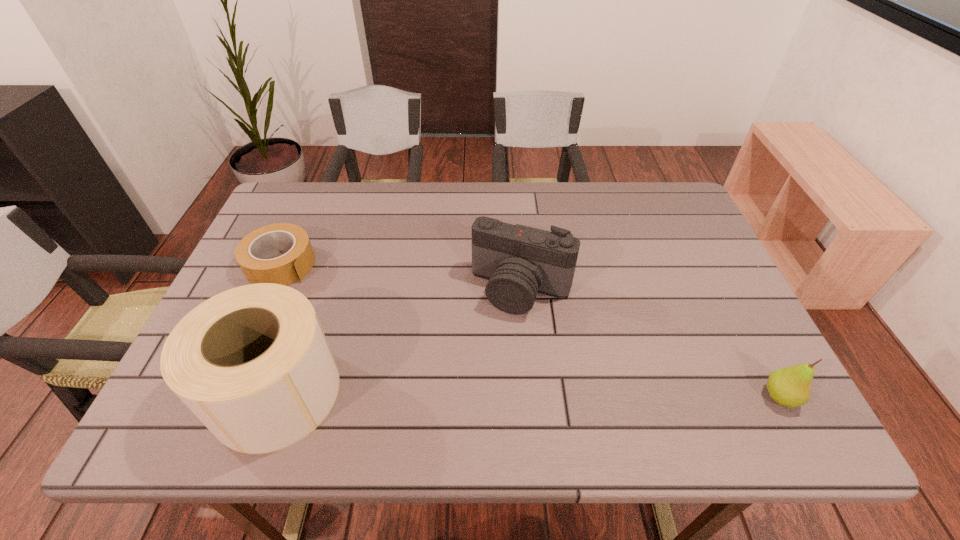
What are the coordinates of `vacant space located at the edge of the shortest object` in the screenshot? It's located at (370, 329).

I want to click on free space located at the edge of the shortest object, so click(339, 306).

This screenshot has width=960, height=540. I want to click on toilet tissue present at the near edge, so click(x=252, y=363).

Where is `pear that is at the near edge`? This screenshot has width=960, height=540. pear that is at the near edge is located at coordinates (790, 386).

You are a GUI agent. You are given a task and a screenshot of the screen. Output one action in this format:
    pyautogui.click(x=<x>, y=<y>)
    Task: Click on the toilet tissue located in the left edge section of the desktop
    This screenshot has width=960, height=540.
    Given the screenshot: What is the action you would take?
    pyautogui.click(x=252, y=363)

In order to click on duct tape that is at the left edge in this screenshot , I will do `click(251, 251)`.

The width and height of the screenshot is (960, 540). Identify the location of object that is at the right edge. (790, 386).

Where is `object that is at the near left corner`? This screenshot has width=960, height=540. object that is at the near left corner is located at coordinates (252, 363).

Locate an element on the screen. object that is positioned at the near right corner is located at coordinates (790, 386).

Identify the location of vacant space at the far edge of the desktop. This screenshot has height=540, width=960. (344, 184).